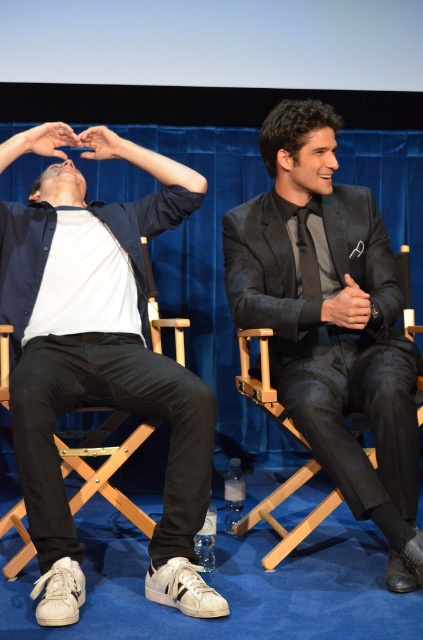
Between matte white hand at upper center and matte black hand at center, which one is positioned lower?

matte black hand at center is below.

This screenshot has height=640, width=423. I want to click on matte white hand at upper center, so click(41, 140).

Which is in front, point (43, 129) or point (357, 300)?

Point (357, 300) is more forward.

Identify the location of matte white hand at upper center. The width and height of the screenshot is (423, 640). (41, 140).

Does point (145, 317) come behind point (365, 310)?

Yes, point (145, 317) is farther from viewer.

Is point (46, 467) positioned in front of point (351, 282)?

Yes.

This screenshot has height=640, width=423. I want to click on white leather sneakers at lower left, so click(x=101, y=371).

The width and height of the screenshot is (423, 640). What are the coordinates of `white leather sneakers at lower left` in the screenshot? It's located at (101, 371).

Is white leather sneakers at lower left smaller than velvet black suit at center?

Incorrect, white leather sneakers at lower left is not smaller in size than velvet black suit at center.

Does white leather sneakers at lower left appear on the right side of velvet black suit at center?

No, white leather sneakers at lower left is not to the right of velvet black suit at center.

Is point (69, 192) in front of point (379, 492)?

That is False.

You are a GUI agent. You are given a task and a screenshot of the screen. Output one action in this format:
    pyautogui.click(x=<x>, y=<y>)
    Task: Click on the white leather sneakers at lower left
    
    Given the screenshot: What is the action you would take?
    pyautogui.click(x=101, y=371)